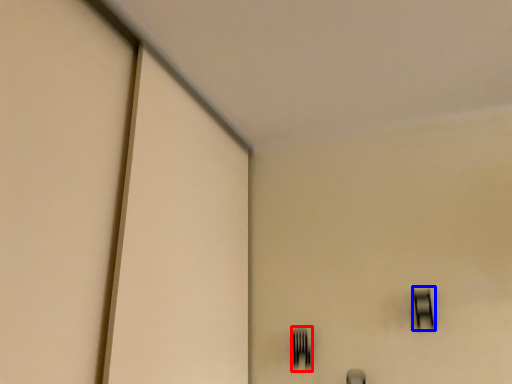
Question: Among these objects, which one is farthest to the camera, fork (highlighted by a red box) or window (highlighted by a blue box)?

Choices:
 (A) fork
 (B) window

Answer: (A)